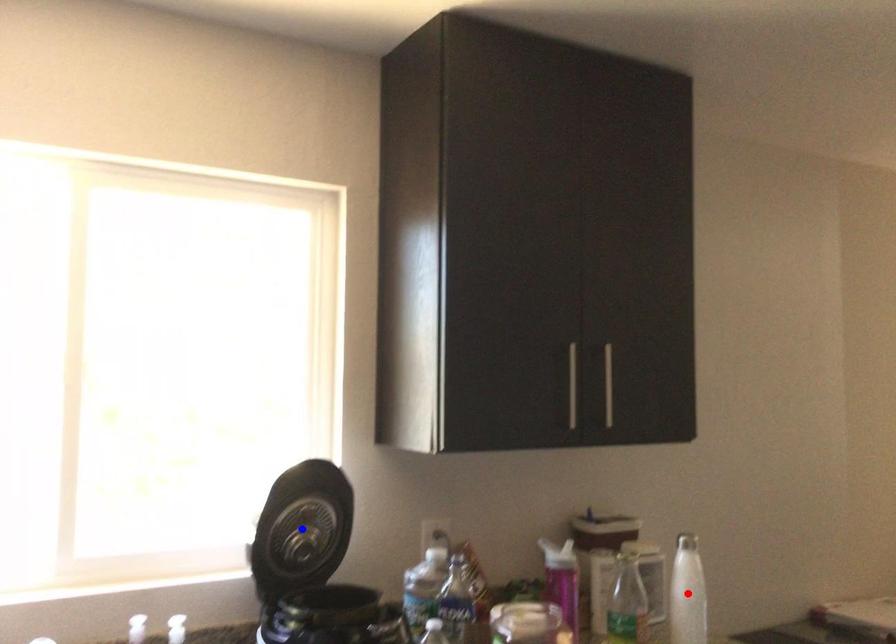
Question: Which of the two points in the image is closer to the camera?

Choices:
 (A) Blue point is closer.
 (B) Red point is closer.

Answer: (A)